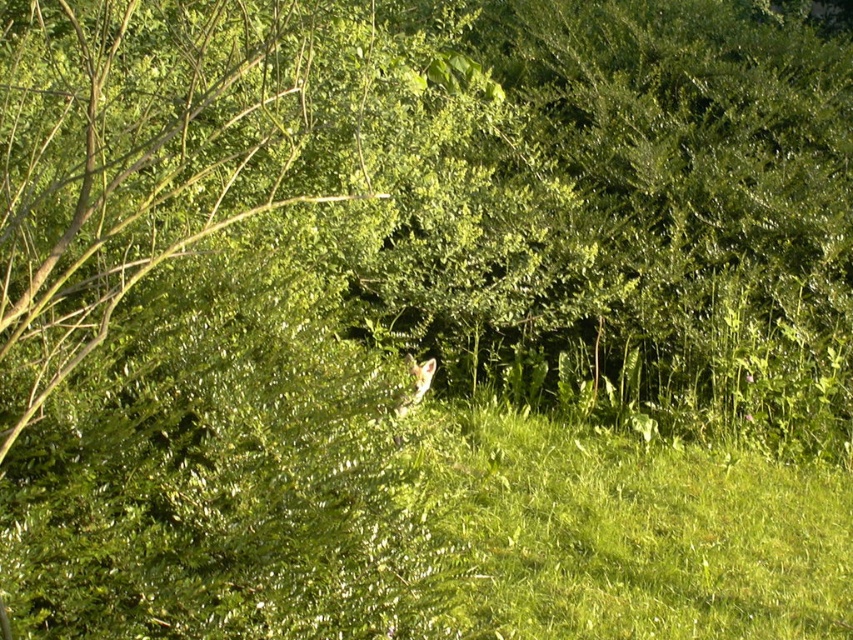
Does green leafy tree at center have a lesser height compared to white fur fox at center?

No, green leafy tree at center is not shorter than white fur fox at center.

Can you confirm if green leafy tree at center is positioned to the left of white fur fox at center?

Indeed, green leafy tree at center is positioned on the left side of white fur fox at center.

Image resolution: width=853 pixels, height=640 pixels. Describe the element at coordinates (173, 152) in the screenshot. I see `green leafy tree at center` at that location.

Identify the location of green leafy tree at center. (173, 152).

Can you confirm if green leafy tree at center is taller than green grassy at center?

Correct, green leafy tree at center is much taller as green grassy at center.

This screenshot has width=853, height=640. What are the coordinates of `green leafy tree at center` in the screenshot? It's located at (173, 152).

Who is positioned more to the left, green grassy at center or white fur fox at center?

Positioned to the left is white fur fox at center.

Is green grassy at center shorter than white fur fox at center?

In fact, green grassy at center may be taller than white fur fox at center.

Image resolution: width=853 pixels, height=640 pixels. Describe the element at coordinates (641, 532) in the screenshot. I see `green grassy at center` at that location.

Where is `green grassy at center`? green grassy at center is located at coordinates (641, 532).